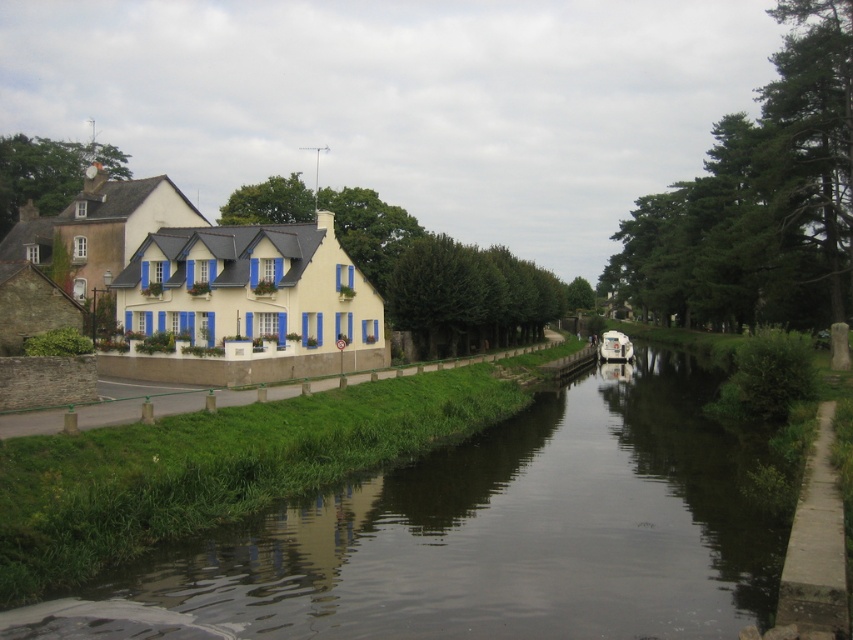
Is white painted wall at left to the right of white glossy boat at center from the viewer's perspective?

In fact, white painted wall at left is to the left of white glossy boat at center.

How distant is white painted wall at left from white glossy boat at center?

white painted wall at left and white glossy boat at center are 36.18 meters apart.

What do you see at coordinates (136, 403) in the screenshot? I see `white painted wall at left` at bounding box center [136, 403].

Where is `white painted wall at left`? This screenshot has height=640, width=853. white painted wall at left is located at coordinates (136, 403).

Who is taller, smooth concrete canal at center or white painted wall at left?

smooth concrete canal at center

Does smooth concrete canal at center appear on the right side of white painted wall at left?

Yes, smooth concrete canal at center is to the right of white painted wall at left.

The width and height of the screenshot is (853, 640). What are the coordinates of `smooth concrete canal at center` in the screenshot? It's located at (486, 536).

Find the location of a particular element. smooth concrete canal at center is located at coordinates (486, 536).

Is point (393, 492) positioned behind point (631, 360)?

No, it is in front of (631, 360).

How far apart are smooth concrete canal at center and white glossy boat at center?

A distance of 177.74 feet exists between smooth concrete canal at center and white glossy boat at center.

Locate an element on the screen. smooth concrete canal at center is located at coordinates (486, 536).